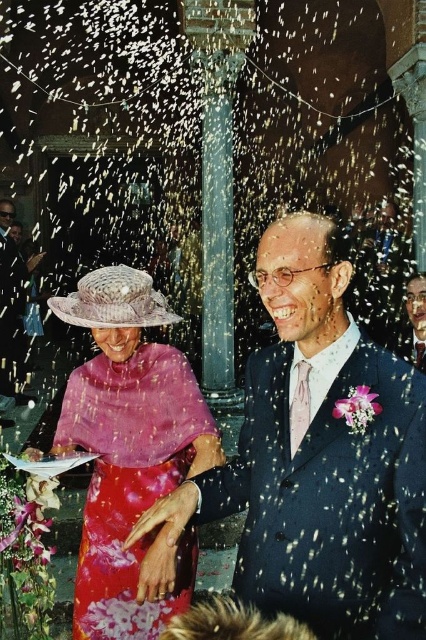
From the picture: You are a photographer at the event. You need to adjust the camera focus so that both the matte pink fabric dress at center and the smooth blue suit at center are in focus. Considering their heights, which one should you focus on first to ensure both are sharp?

The matte pink fabric dress at center is taller than the smooth blue suit at center. To ensure both are in focus, you should focus on the taller matte pink fabric dress at center first, as focusing on the taller subject will more likely include the shorter one within the depth of field.

In the scene shown: You are a photographer at this event and need to frame a shot that includes both the matte pink fabric dress at center and the smooth blue suit at center. Given the space constraints, will the wider of the two outfits fit comfortably within the camera frame if the frame can accommodate up to the width of the wider outfit?

The matte pink fabric dress at center is wider than the smooth blue suit at center. Since the camera frame can accommodate up to the width of the wider outfit, the wider matte pink fabric dress at center will fit comfortably within the frame.